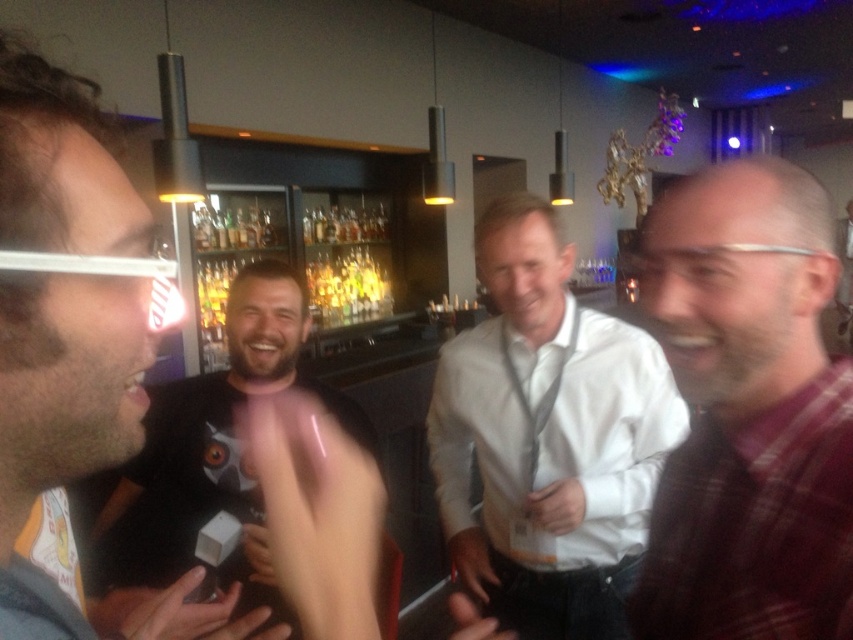
Question: Where is plaid fabric shirt at right located in relation to black matte t-shirt at center in the image?

Choices:
 (A) right
 (B) left

Answer: (A)

Question: Which is farther from the black matte t-shirt at center?

Choices:
 (A) plaid fabric shirt at right
 (B) matte black shirt at left
 (C) white shirt at center

Answer: (A)

Question: Is plaid fabric shirt at right positioned before matte black shirt at left?

Choices:
 (A) yes
 (B) no

Answer: (B)

Question: Among these points, which one is farthest from the camera?

Choices:
 (A) (192, 444)
 (B) (830, 637)

Answer: (A)

Question: Can you confirm if plaid fabric shirt at right is positioned above white shirt at center?

Choices:
 (A) no
 (B) yes

Answer: (B)

Question: Which of the following is the closest to the observer?

Choices:
 (A) white shirt at center
 (B) plaid fabric shirt at right
 (C) matte black shirt at left
 (D) black matte t-shirt at center

Answer: (C)